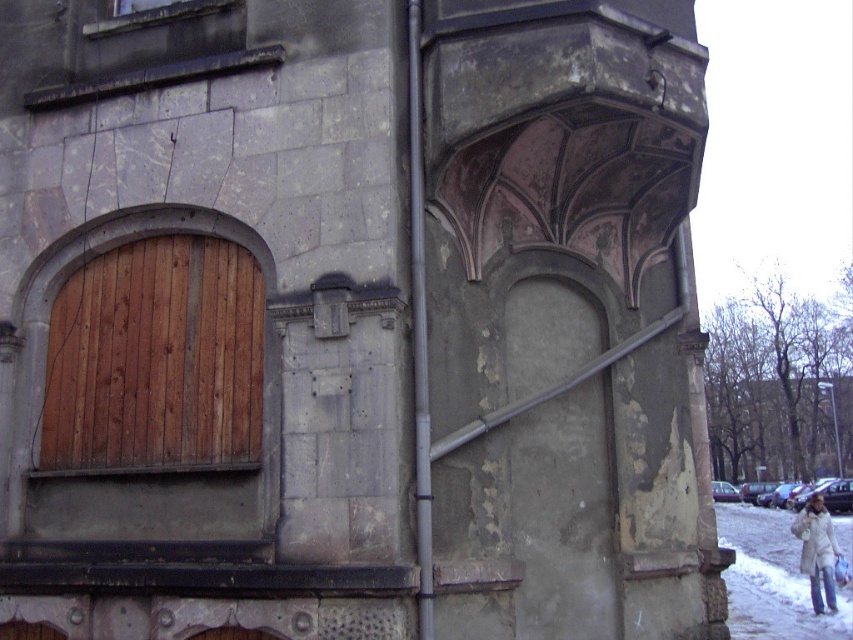
Question: Considering the real-world distances, which object is farthest from the white snow at lower right?

Choices:
 (A) white fuzzy coat at lower right
 (B) wooden at left

Answer: (B)

Question: Which object is positioned farthest from the wooden at left?

Choices:
 (A) white snow at lower right
 (B) white fuzzy coat at lower right

Answer: (B)

Question: Can you confirm if white snow at lower right is bigger than white fuzzy coat at lower right?

Choices:
 (A) no
 (B) yes

Answer: (B)

Question: Which of the following is the farthest from the observer?

Choices:
 (A) (833, 588)
 (B) (138, 448)
 (C) (737, 593)

Answer: (C)

Question: Is wooden at left to the left of white snow at lower right from the viewer's perspective?

Choices:
 (A) yes
 (B) no

Answer: (A)

Question: Is white snow at lower right wider than white fuzzy coat at lower right?

Choices:
 (A) no
 (B) yes

Answer: (B)